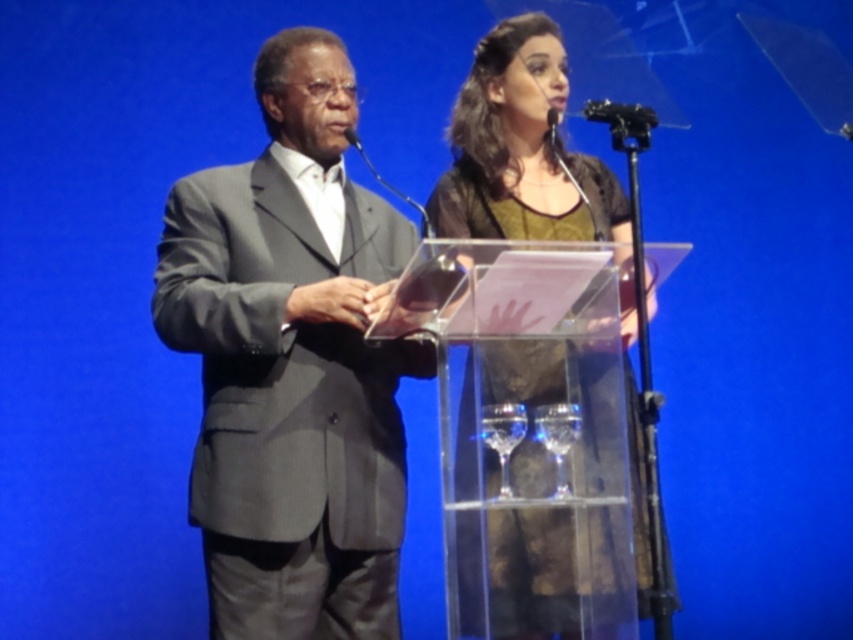
From the picture: Between gray suit at left and matte brown dress at center, which one appears on the left side from the viewer's perspective?

gray suit at left is more to the left.

What do you see at coordinates (292, 364) in the screenshot?
I see `gray suit at left` at bounding box center [292, 364].

Locate an element on the screen. The width and height of the screenshot is (853, 640). gray suit at left is located at coordinates (292, 364).

Does gray suit at left have a larger size compared to black plastic microphone at upper center?

Correct, gray suit at left is larger in size than black plastic microphone at upper center.

Is gray suit at left to the right of black plastic microphone at upper center from the viewer's perspective?

No, gray suit at left is not to the right of black plastic microphone at upper center.

Find the location of a particular element. The width and height of the screenshot is (853, 640). gray suit at left is located at coordinates (292, 364).

Who is more distant from viewer, (502,125) or (357,134)?

The point (357,134) is more distant.

Is matte brown dress at center shorter than black plastic microphone at upper center?

Incorrect, matte brown dress at center's height does not fall short of black plastic microphone at upper center's.

Image resolution: width=853 pixels, height=640 pixels. I want to click on matte brown dress at center, so click(x=520, y=150).